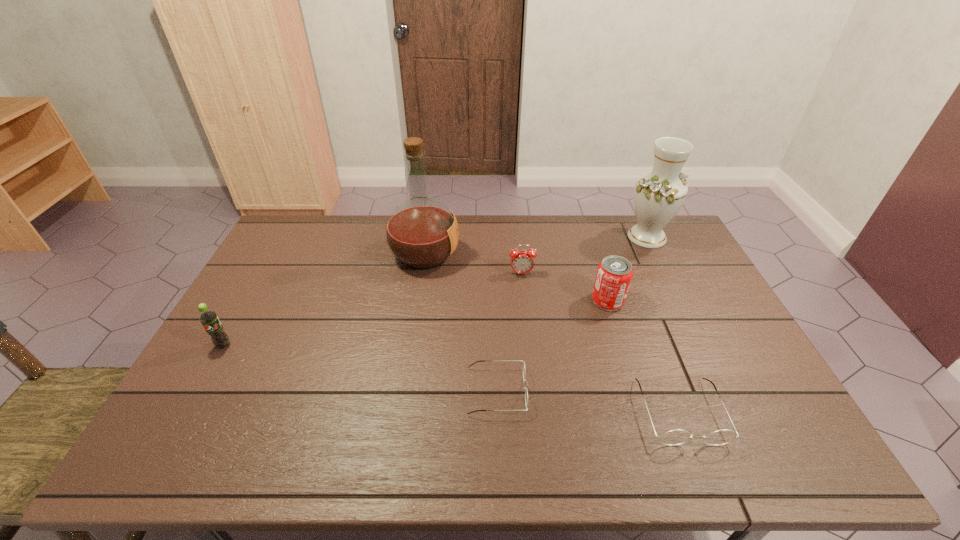
Considering the uniform spacing of spectacless, where should an additional spectacles be positioned on the left? Please locate a free spot. Please provide its 2D coordinates. Your answer should be formatted as a tuple, i.e. [(x, y)], where the tuple contains the x and y coordinates of a point satisfying the conditions above.

[(328, 372)]